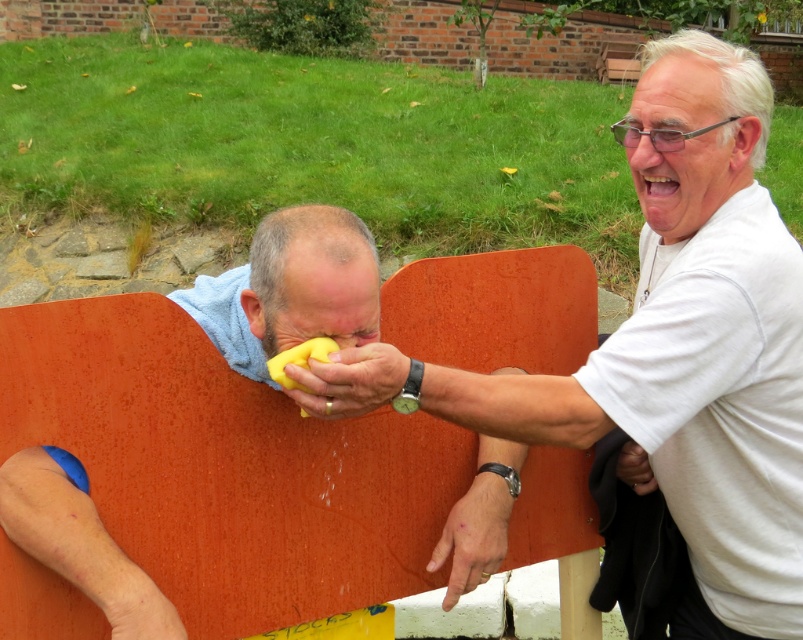
Question: Which point is closer to the camera?

Choices:
 (A) [706, 262]
 (B) [276, 372]

Answer: (B)

Question: Which point is closer to the camera?

Choices:
 (A) (304, 353)
 (B) (677, 150)

Answer: (A)

Question: Considering the relative positions of orange painted wood park bench at center and yellow rubber duck at center in the image provided, where is orange painted wood park bench at center located with respect to yellow rubber duck at center?

Choices:
 (A) left
 (B) right

Answer: (A)

Question: Is orange painted wood park bench at center further to camera compared to yellow rubber sponge at center?

Choices:
 (A) yes
 (B) no

Answer: (B)

Question: Which point appears closest to the camera in this image?

Choices:
 (A) (274, 374)
 (B) (638, 152)

Answer: (A)

Question: Does yellow rubber duck at center have a lesser width compared to yellow rubber sponge at center?

Choices:
 (A) yes
 (B) no

Answer: (B)